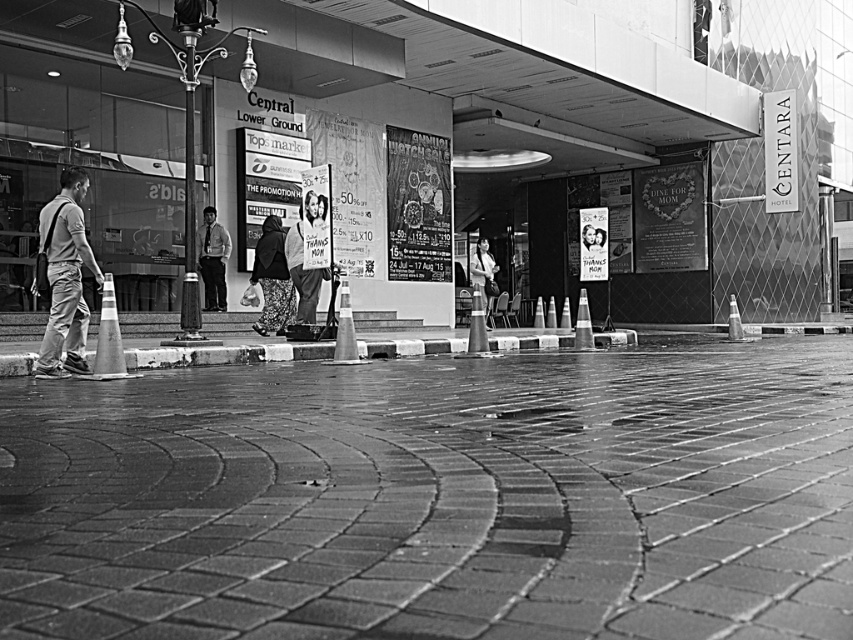
Question: Is light brown shirt at center positioned before matte black dress at center?

Choices:
 (A) yes
 (B) no

Answer: (B)

Question: Which object is the closest to the matte black dress at center?

Choices:
 (A) matte white sign at center
 (B) light gray jeans at left
 (C) light brown shirt at center
 (D) smooth concrete pavement at center

Answer: (A)

Question: Is light gray jeans at left bigger than floral-patterned pants at center?

Choices:
 (A) no
 (B) yes

Answer: (A)

Question: Observing the image, what is the correct spatial positioning of light brown shirt at center in reference to matte black dress at center?

Choices:
 (A) left
 (B) right

Answer: (A)

Question: Which object appears farthest from the camera in this image?

Choices:
 (A) smooth concrete pavement at center
 (B) light brown shirt at center
 (C) floral-patterned pants at center

Answer: (B)

Question: Which object is positioned farthest from the smooth concrete pavement at center?

Choices:
 (A) light gray jeans at left
 (B) floral-patterned pants at center
 (C) matte white sign at center

Answer: (B)